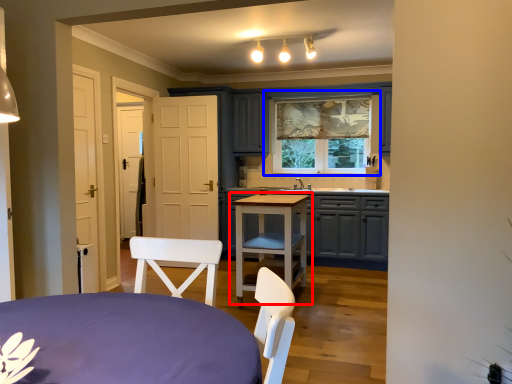
Question: Which point is closer to the camera, table (highlighted by a red box) or window (highlighted by a blue box)?

Choices:
 (A) table
 (B) window

Answer: (A)